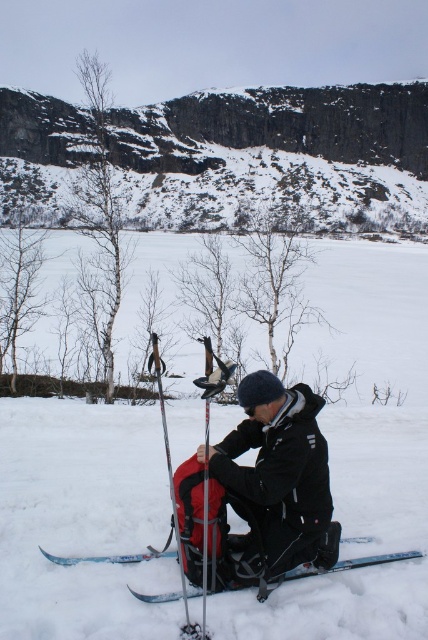
You are a winter sports instructor observing the scene. You need to ensure that the equipment is properly stored. Based on the height difference between the white matte snow at center and the matte black ski pole at center, can the ski pole be fully buried in the snow without any part sticking out?

The white matte snow at center has a greater height compared to the matte black ski pole at center. This means the snow is deeper than the ski pole, so the ski pole can be fully buried in the snow without any part sticking out.

You are a winter hiker who wants to place your backpack on the snow. Based on the scene, can you confirm if the white matte snow at center is positioned to the left of the matte black backpack at center?

Yes, the white matte snow at center is to the left of the matte black backpack at center according to the description.

You are a winter athlete preparing for a ski run. You notice the white matte snow at center and the blue metallic ski at center. Which object is positioned to the left of the other?

The white matte snow at center is to the left of the blue metallic ski at center.